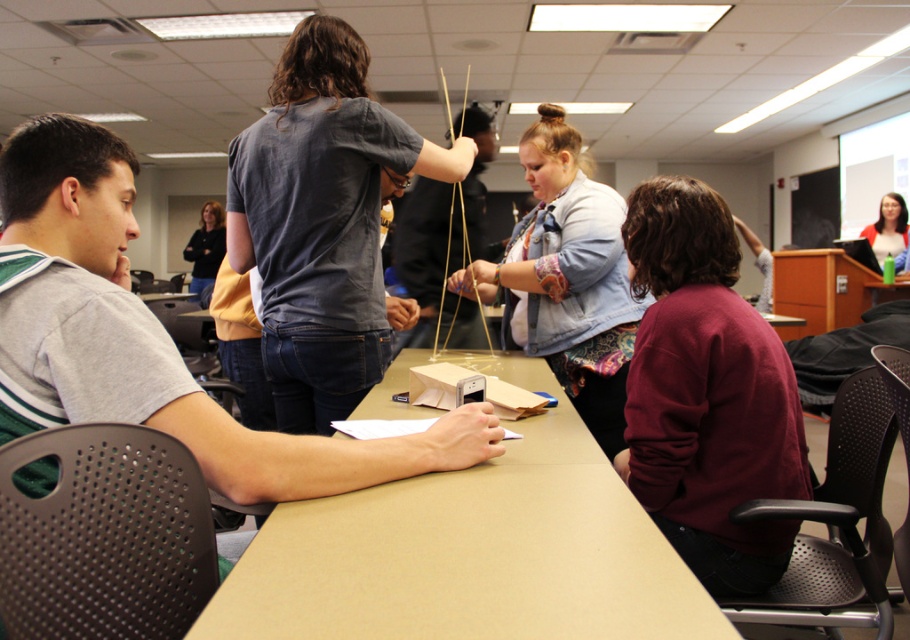
You are organizing a clothing donation drive and need to decide which items to place in a small donation box. Given the maroon sweater at lower right and the denim jacket at center, which one would fit better in the box based on their sizes?

The maroon sweater at lower right occupies less space than the denim jacket at center, so it would fit better in the small donation box.

You are a student in the classroom and need to decide which item to place on a shelf that can only hold items shorter than the denim jacket at center. Can the maroon sweater at lower right be placed there?

The maroon sweater at lower right has a lesser height compared to the denim jacket at center, so it can be placed on the shelf since its height is shorter than the denim jacket at center.